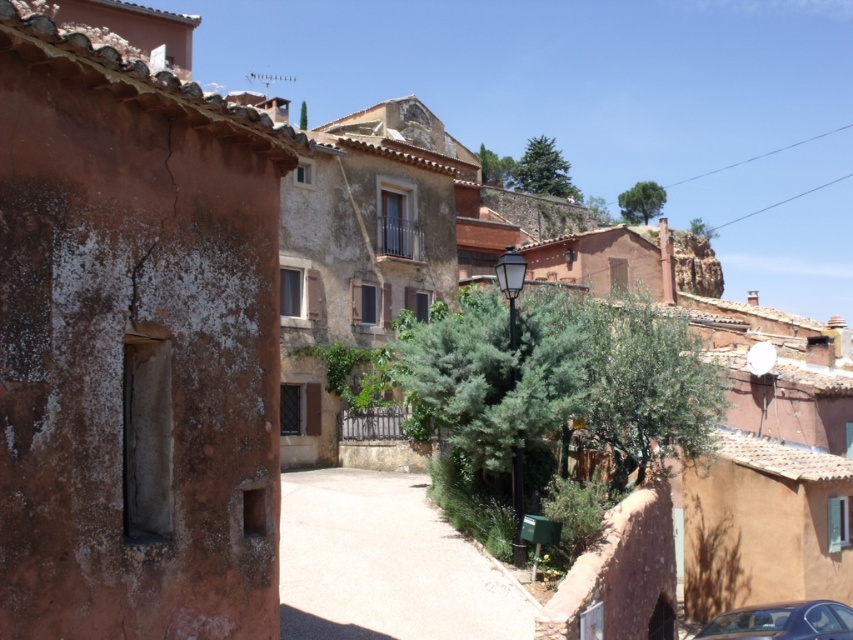
You are standing on the street looking at the two points marked in the image. Which point is closer to you, point (395, 509) or point (735, 627)?

Point (735, 627) is closer to you because point (395, 509) is behind it.

What is the spatial relationship between the smooth concrete path at center and the metallic silver car at lower right in the scene?

The smooth concrete path at center is located above the metallic silver car at lower right.

You are a delivery person trying to drive a metallic silver car at lower right through the smooth concrete path at center. Based on the scene description, can the car fit through the path?

The smooth concrete path at center is wider than the metallic silver car at lower right, so the car can fit through the path.